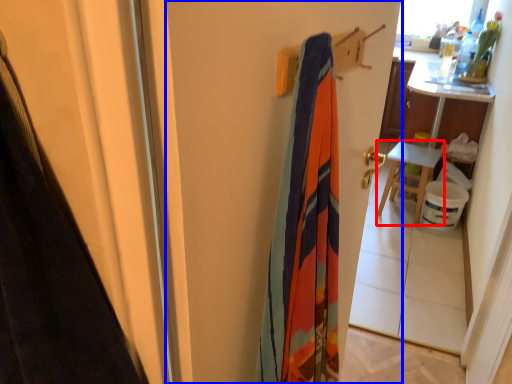
Question: Which object appears closest to the camera in this image, furniture (highlighted by a red box) or screen door (highlighted by a blue box)?

Choices:
 (A) furniture
 (B) screen door

Answer: (B)